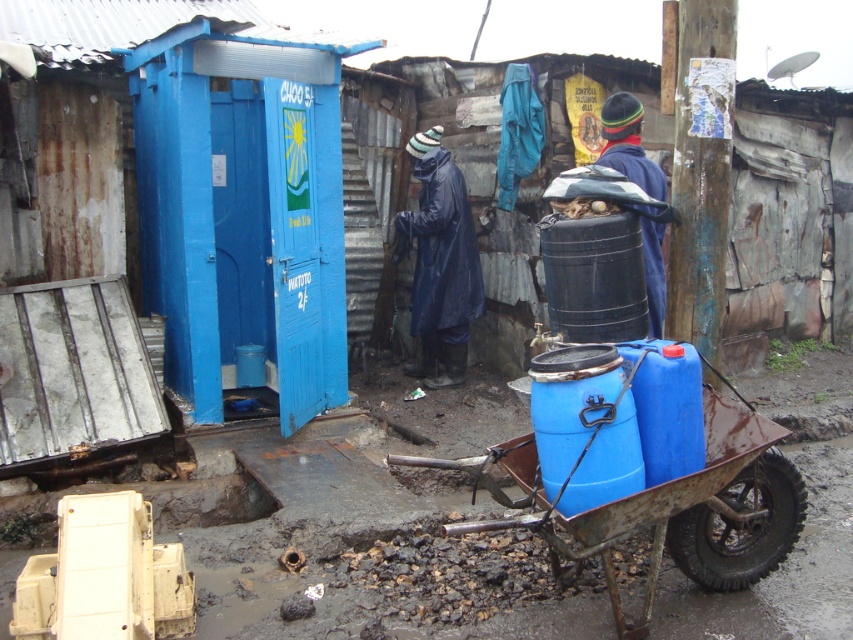
Question: Can you confirm if shiny blue raincoat at center is bigger than blue fabric jacket at center?

Choices:
 (A) no
 (B) yes

Answer: (B)

Question: Considering the relative positions of blue plastic cart at lower center and blue fabric jacket at center in the image provided, where is blue plastic cart at lower center located with respect to blue fabric jacket at center?

Choices:
 (A) right
 (B) left

Answer: (B)

Question: Which of the following is the farthest from the observer?

Choices:
 (A) blue plastic cart at lower center
 (B) blue fabric jacket at center

Answer: (B)

Question: Which point is closer to the camera?

Choices:
 (A) (425, 218)
 (B) (601, 124)

Answer: (B)

Question: Can you confirm if blue plastic cart at lower center is thinner than blue fabric jacket at center?

Choices:
 (A) yes
 (B) no

Answer: (B)

Question: Which object is farther from the camera taking this photo?

Choices:
 (A) shiny blue raincoat at center
 (B) blue fabric jacket at center

Answer: (A)